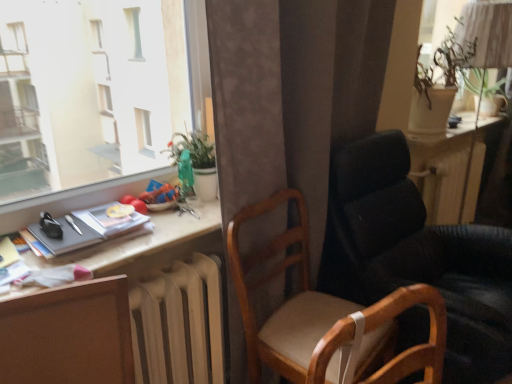
Question: Considering the positions of wooden chair at center, the 2th chair positioned from the right, and green glossy plant at upper center, which is the 1th houseplant in front-to-back order, in the image, is wooden chair at center, the 2th chair positioned from the right, taller or shorter than green glossy plant at upper center, which is the 1th houseplant in front-to-back order,?

Choices:
 (A) tall
 (B) short

Answer: (A)

Question: Visually, is wooden chair at center, which is the first chair in left-to-right order, positioned to the left or to the right of green glossy plant at upper center, which is counted as the second houseplant, starting from the right?

Choices:
 (A) right
 (B) left

Answer: (A)

Question: Considering the real-world distances, which object is closest to the wooden table at lower left, the 1th table when ordered from front to back?

Choices:
 (A) green glossy plant at upper center, which is the 1th houseplant in front-to-back order
 (B) matte black book at left
 (C) green matte plant at upper right, the 1th houseplant when ordered from right to left
 (D) wooden chair at center, which is the first chair in left-to-right order
 (E) brown wood desk at lower left

Answer: (E)

Question: Based on their relative distances, which object is farther from the white matte radiator at lower center?

Choices:
 (A) wooden chair at center, which is the first chair in left-to-right order
 (B) matte white window sill at lower left
 (C) green matte plant at upper right, the 2th houseplant positioned from the left
 (D) wooden table at right, acting as the 1th table starting from the back
 (E) beige fabric swivel chair at center

Answer: (D)